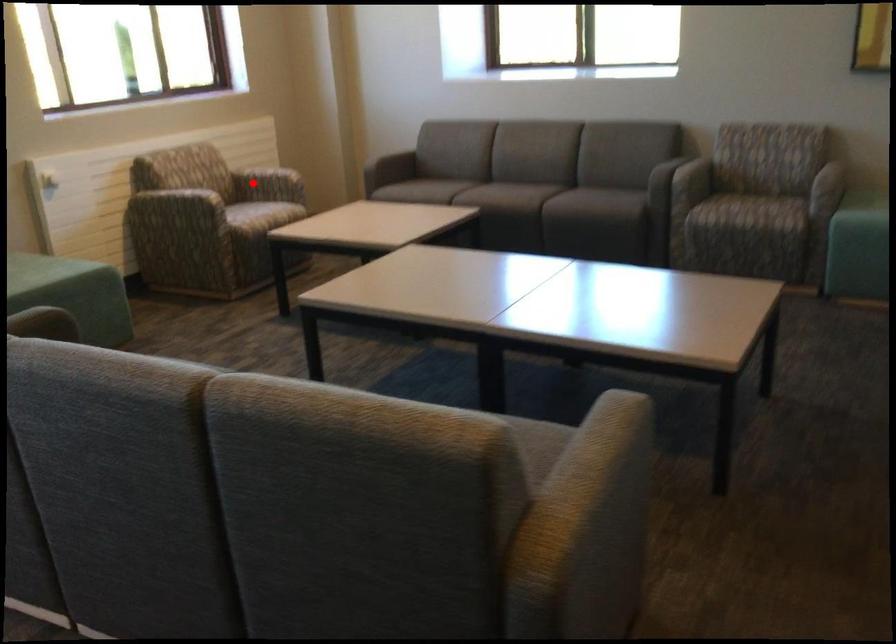
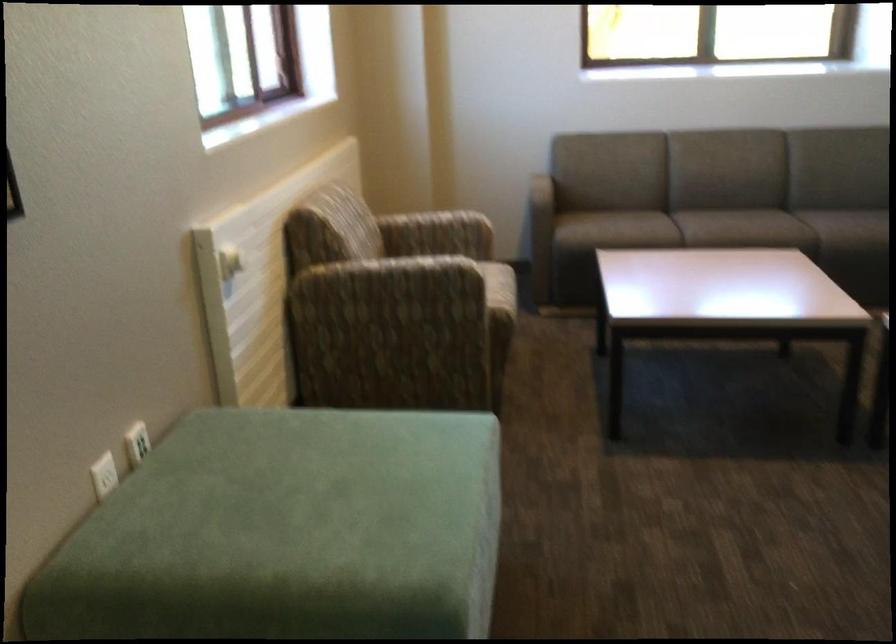
Question: I am providing you with two images of the same scene from different viewpoints. A red point is shown in image1. For the corresponding object point in image2, is it positioned nearer or farther from the camera?

Choices:
 (A) Nearer
 (B) Farther

Answer: (A)